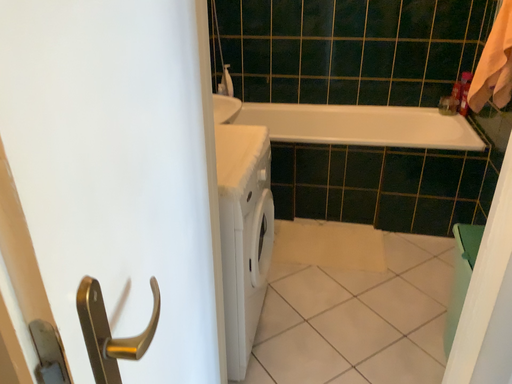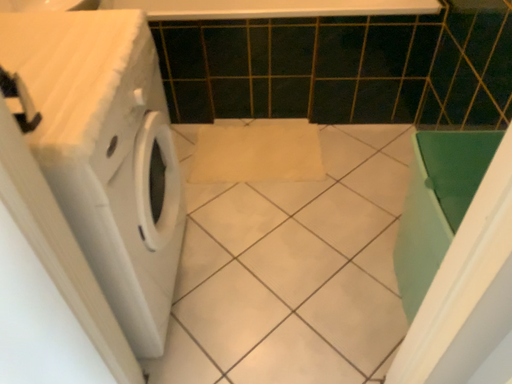
Question: How did the camera likely rotate when shooting the video?

Choices:
 (A) rotated upward
 (B) rotated downward

Answer: (B)